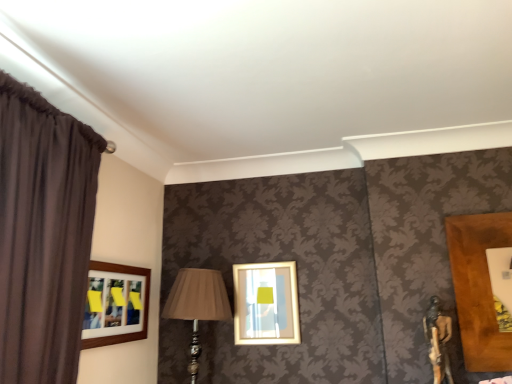
Question: Based on their positions, is wooden-framed picture at left, placed as the second picture frame when sorted from right to left, located to the left or right of dark brown fabric curtain at left?

Choices:
 (A) left
 (B) right

Answer: (B)

Question: From their relative heights in the image, would you say wooden-framed picture at left, placed as the 1th picture frame when sorted from left to right, is taller or shorter than dark brown fabric curtain at left?

Choices:
 (A) short
 (B) tall

Answer: (A)

Question: Considering the real-world distances, which object is farthest from the matte gold picture frame at center, which ranks as the 1th picture frame in right-to-left order?

Choices:
 (A) wooden-framed picture at left, placed as the 1th picture frame when sorted from left to right
 (B) matte beige fabric at center
 (C) dark brown fabric curtain at left

Answer: (C)

Question: Estimate the real-world distances between objects in this image. Which object is closer to the wooden-framed picture at left, placed as the second picture frame when sorted from right to left?

Choices:
 (A) matte gold picture frame at center, arranged as the 2th picture frame when viewed from the left
 (B) dark brown fabric curtain at left
 (C) matte beige fabric at center

Answer: (C)